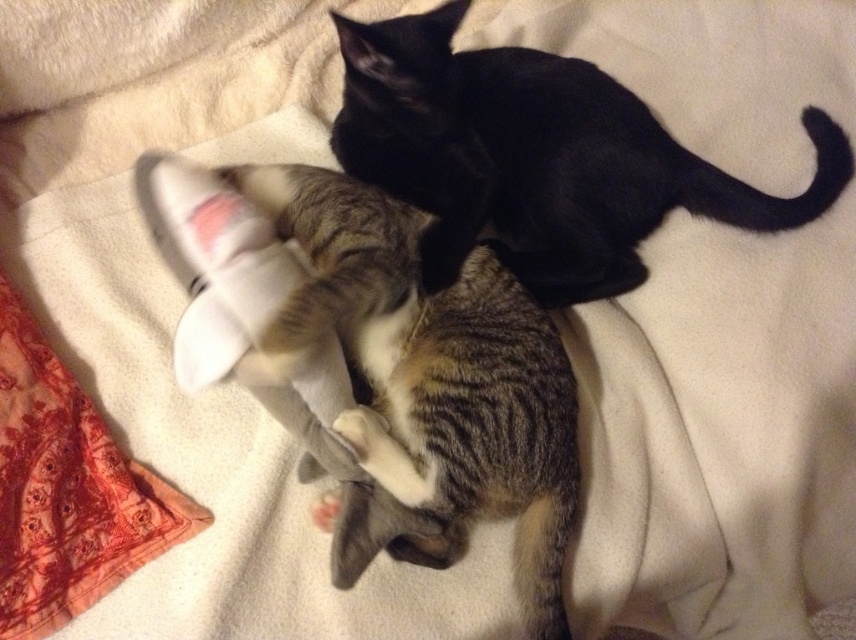
Question: Can you confirm if striped fur cat at center is wider than black glossy cat at upper center?

Choices:
 (A) yes
 (B) no

Answer: (B)

Question: Is striped fur cat at center above black glossy cat at upper center?

Choices:
 (A) yes
 (B) no

Answer: (B)

Question: Which of the following is the farthest from the observer?

Choices:
 (A) (474, 499)
 (B) (578, 60)

Answer: (B)

Question: Is striped fur cat at center behind black glossy cat at upper center?

Choices:
 (A) yes
 (B) no

Answer: (B)

Question: Which point is closer to the camera taking this photo?

Choices:
 (A) (402, 486)
 (B) (571, 244)

Answer: (A)

Question: Which object appears closest to the camera in this image?

Choices:
 (A) black glossy cat at upper center
 (B) striped fur cat at center

Answer: (B)